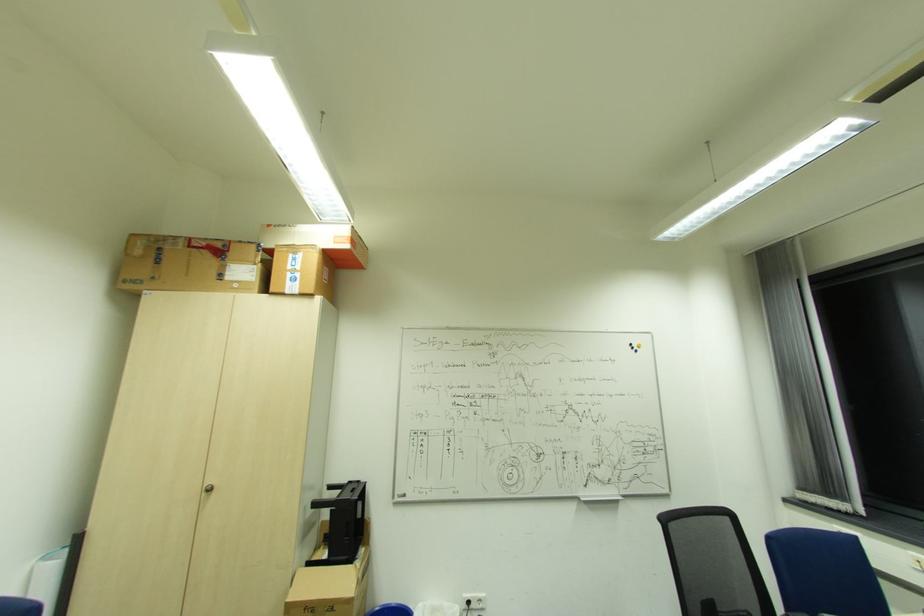
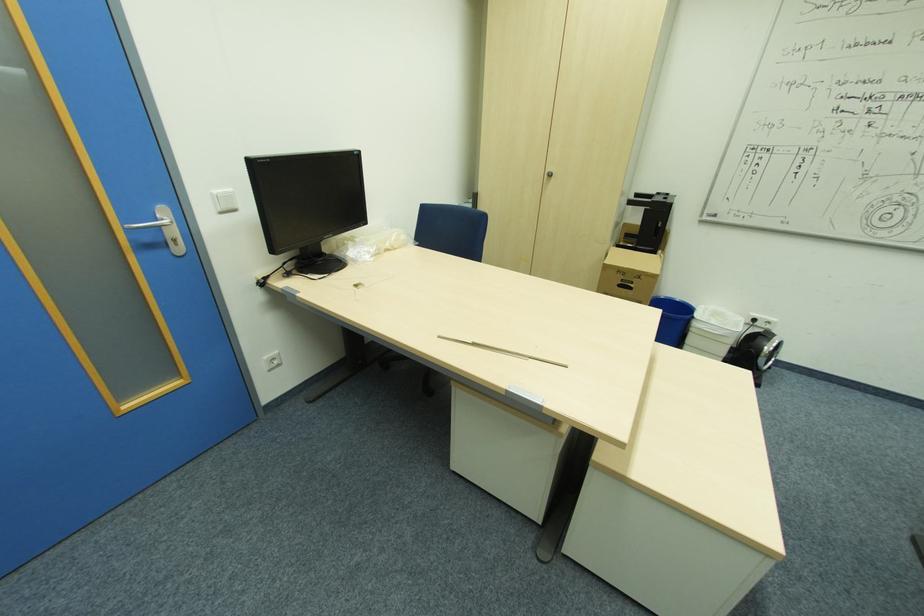
Find the pixel in the second image that matches [213,488] in the first image.

(553, 175)